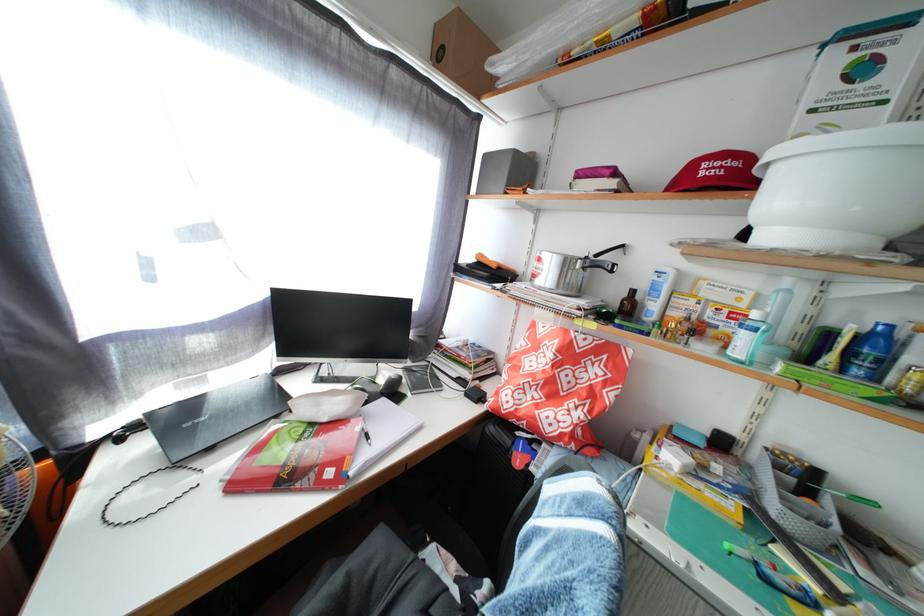
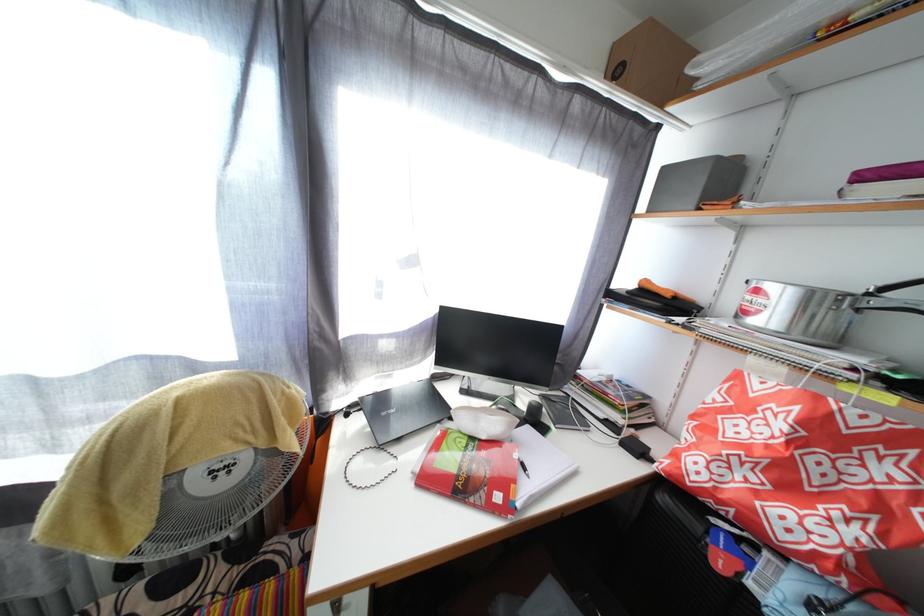
Question: Based on the continuous images, in which direction is the camera rotating? Reply with the corresponding letter.

Choices:
 (A) Left
 (B) Right
 (C) Up
 (D) Down

Answer: (A)